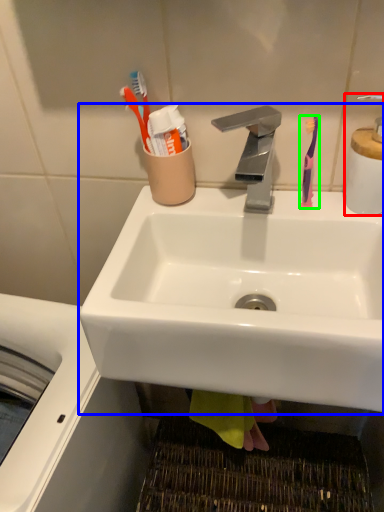
Question: Which is farther away from soap dispenser (highlighted by a red box)? sink (highlighted by a blue box) or toothbrush (highlighted by a green box)?

Choices:
 (A) sink
 (B) toothbrush

Answer: (A)